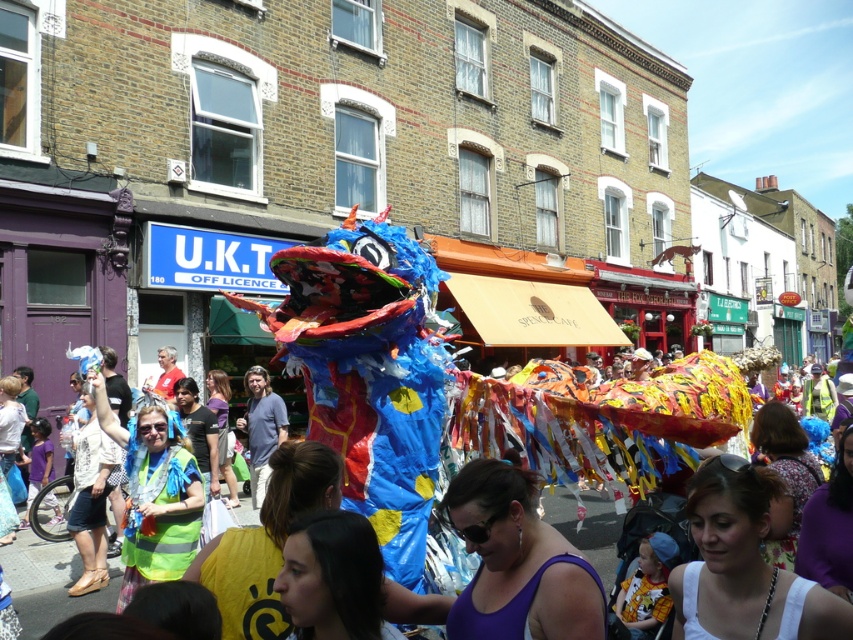
You are standing in the middle of the street during the parade and see two points marked on the dragon figure. The first point is at coordinates point (566, 577) and the second is at point (561, 516). Which point is closer to you?

Point (566, 577) is closer to the viewer than point (561, 516).

You are a photographer at the parade trying to capture both the purple fabric at center and the colorful paper dragon at center in a single frame. Which object should you focus on first to ensure both are in the shot?

The purple fabric at center is shorter than the colorful paper dragon at center, so you should focus on the colorful paper dragon at center first to ensure both are in the shot.

You are a photographer standing at the edge of the street. You want to take a photo of the purple fabric at center and the colorful paper dragon at center so that both are in focus. The camera you are using has a depth of field that can sharply focus on objects within 3 meters. Can you capture both objects clearly in the same photo?

The purple fabric at center is 3.65 meters away from the colorful paper dragon at center. Since the distance between them exceeds the camera s 3 meter depth of field range, it would be challenging to have both objects in focus simultaneously. You might need to adjust your position or use a different camera setting to ensure both are sharp.